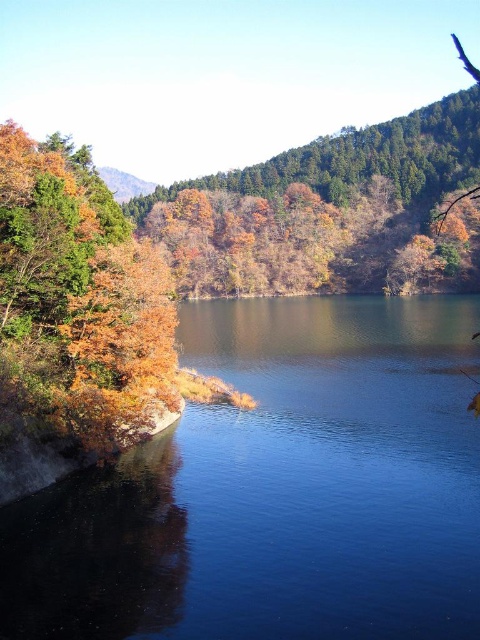
Consider the image. You are standing in the forest and see two groups of autumn leaves, autumn leaves at center and autumn leaves at left. Which group is higher up in the scene?

The autumn leaves at center is located above autumn leaves at left, so the group at the center is higher up in the scene.

You are standing at the point labeled point (276, 490) in the image. What is the closest object to you in the scene?

The closest object to you at point (276, 490) is the blue smooth water at left, as the point is directly representing it.

You are standing in the forest and see the blue smooth water at left and the autumn leaves at left. Which object is located below the other?

The blue smooth water at left is positioned under autumn leaves at left, so the water is below the leaves.